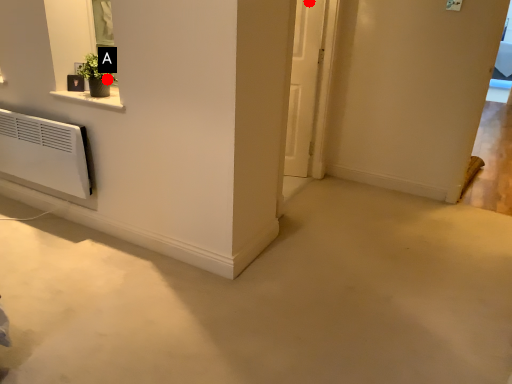
Question: Two points are circled on the image, labeled by A and B beside each circle. Among these points, which one is farthest from the camera?

Choices:
 (A) A is further
 (B) B is further

Answer: (B)